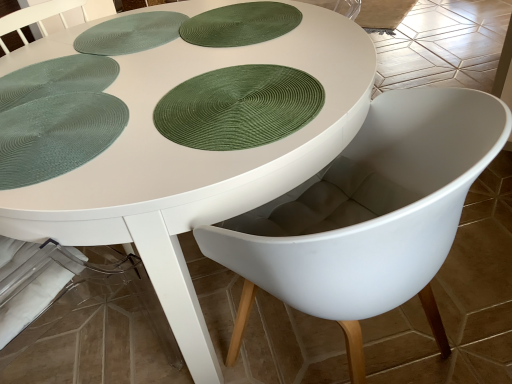
At what (x,y) coordinates should I click in order to perform the action: click on empty space that is ontop of green textured placemat at upper left, the 2th paper plate when ordered from top to bottom. Please return your answer as a coordinate pair (x, y). Looking at the image, I should click on (50, 82).